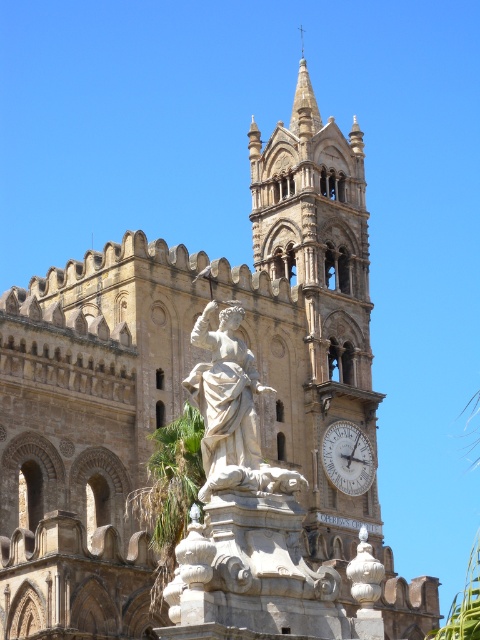
Question: Can you confirm if white marble clock at upper center is smaller than smooth stone spire at upper center?

Choices:
 (A) yes
 (B) no

Answer: (A)

Question: Among these objects, which one is farthest from the camera?

Choices:
 (A) white marble statue at center
 (B) smooth stone spire at upper center
 (C) white marble clock at upper center

Answer: (B)

Question: Which of the following is the closest to the observer?

Choices:
 (A) white marble statue at center
 (B) stone clock tower at center
 (C) smooth stone spire at upper center
 (D) white marble clock at upper center

Answer: (A)

Question: Where is stone clock tower at center located in relation to white marble statue at center in the image?

Choices:
 (A) right
 (B) left

Answer: (A)

Question: Which point is closer to the camera?

Choices:
 (A) white marble clock at upper center
 (B) smooth stone spire at upper center

Answer: (A)

Question: Considering the relative positions of white marble statue at center and smooth stone spire at upper center in the image provided, where is white marble statue at center located with respect to smooth stone spire at upper center?

Choices:
 (A) right
 (B) left

Answer: (B)